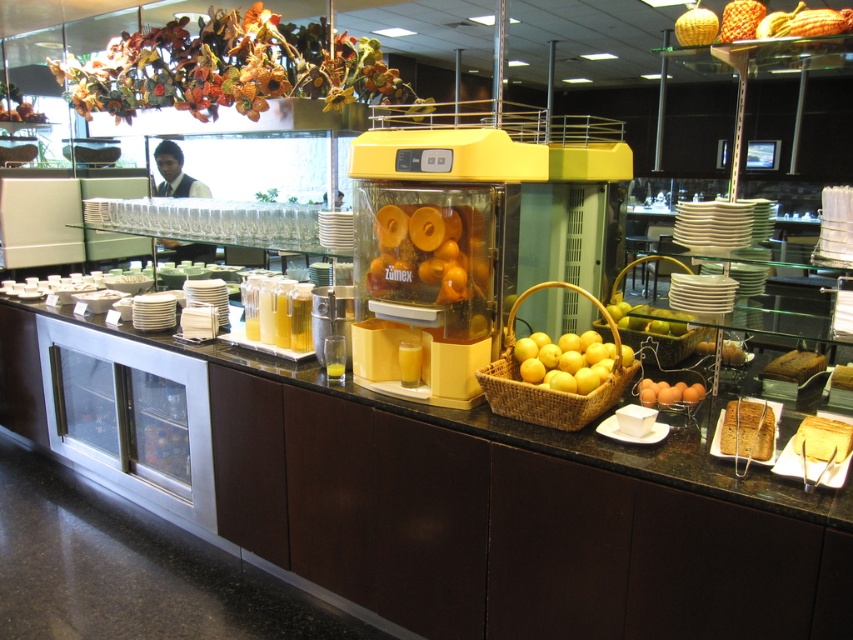
Image resolution: width=853 pixels, height=640 pixels. What do you see at coordinates (747, 429) in the screenshot? I see `brown crumbly bread at right` at bounding box center [747, 429].

Locate an element on the screen. The image size is (853, 640). brown crumbly bread at right is located at coordinates (747, 429).

Which is more to the left, orange matte juicer at center or brown crumbly cake at right?

From the viewer's perspective, orange matte juicer at center appears more on the left side.

Is orange matte juicer at center below brown crumbly cake at right?

No, orange matte juicer at center is not below brown crumbly cake at right.

Measure the distance between point (413, 236) and camera.

Point (413, 236) and camera are 6.66 feet apart from each other.

Locate an element on the screen. The width and height of the screenshot is (853, 640). orange matte juicer at center is located at coordinates point(428,253).

Between brown woven basket at center and yellow sponge cake at center, which one is positioned lower?

Positioned lower is yellow sponge cake at center.

Does brown woven basket at center appear under yellow sponge cake at center?

No.

Who is more distant from viewer, (647, 301) or (846, 380)?

Point (647, 301)

The image size is (853, 640). In order to click on brown woven basket at center in this screenshot , I will do `click(660, 330)`.